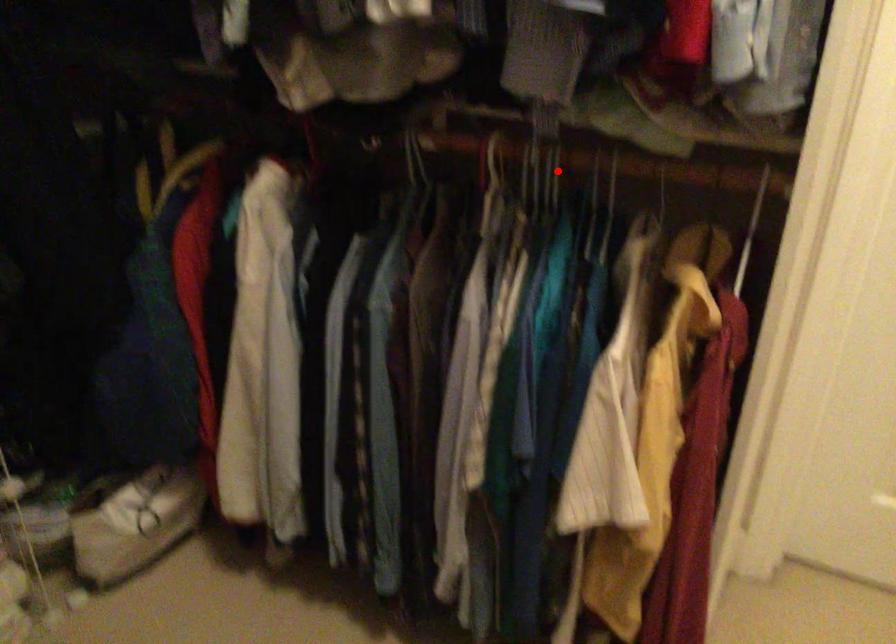
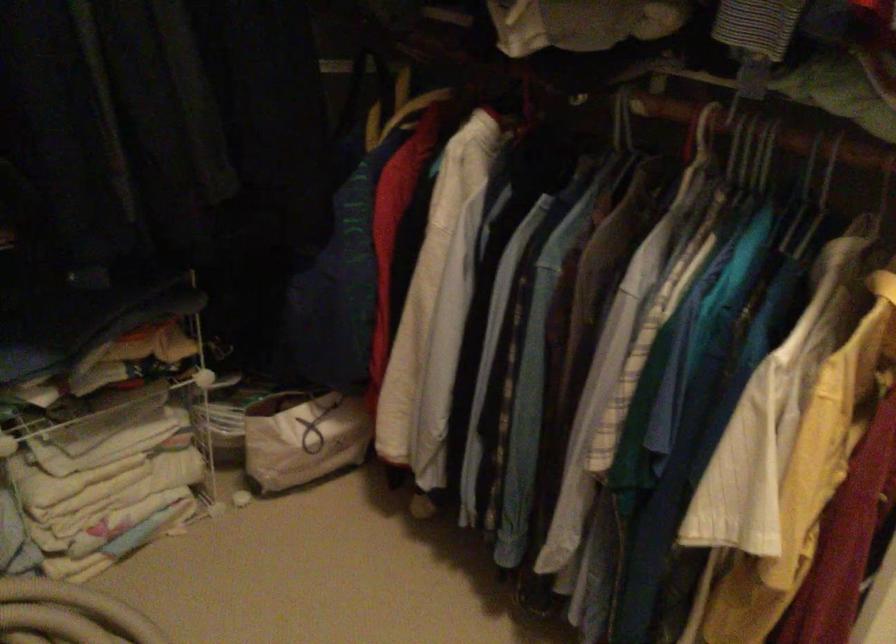
In the second image, find the point that corresponds to the highlighted location in the first image.

(767, 154)